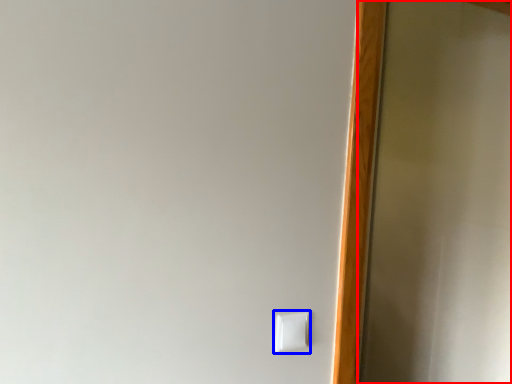
Question: Which point is closer to the camera, screen door (highlighted by a red box) or light switch (highlighted by a blue box)?

Choices:
 (A) screen door
 (B) light switch

Answer: (B)